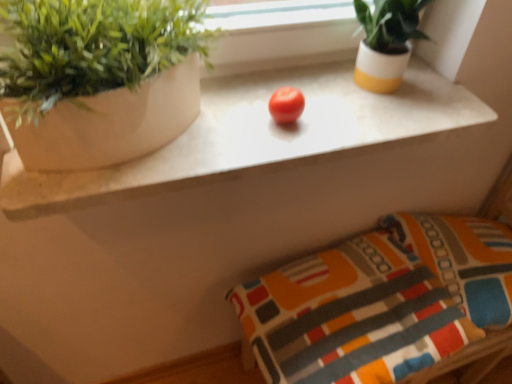
Question: Is textured fabric pillow at lower right, acting as the 2th pillow starting from the right, facing towards red matte tomato at center?

Choices:
 (A) no
 (B) yes

Answer: (A)

Question: Is textured fabric pillow at lower right, acting as the 2th pillow starting from the right, bigger than red matte tomato at center?

Choices:
 (A) yes
 (B) no

Answer: (A)

Question: Can you confirm if textured fabric pillow at lower right, the first pillow when ordered from left to right, is positioned to the left of red matte tomato at center?

Choices:
 (A) yes
 (B) no

Answer: (B)

Question: Is textured fabric pillow at lower right, the first pillow when ordered from left to right, far away from red matte tomato at center?

Choices:
 (A) no
 (B) yes

Answer: (A)

Question: From a real-world perspective, is textured fabric pillow at lower right, acting as the 2th pillow starting from the right, positioned under red matte tomato at center based on gravity?

Choices:
 (A) yes
 (B) no

Answer: (A)

Question: From the image's perspective, is textured fabric pillow at lower right, acting as the 2th pillow starting from the right, under red matte tomato at center?

Choices:
 (A) yes
 (B) no

Answer: (A)

Question: From the image's perspective, is white marble counter at center above red matte tomato at center?

Choices:
 (A) no
 (B) yes

Answer: (A)

Question: Is the position of white marble counter at center more distant than that of red matte tomato at center?

Choices:
 (A) no
 (B) yes

Answer: (A)

Question: Would you say white marble counter at center is outside red matte tomato at center?

Choices:
 (A) no
 (B) yes

Answer: (B)

Question: Is white marble counter at center touching red matte tomato at center?

Choices:
 (A) no
 (B) yes

Answer: (A)

Question: Is white marble counter at center shorter than red matte tomato at center?

Choices:
 (A) no
 (B) yes

Answer: (B)

Question: Is white marble counter at center smaller than red matte tomato at center?

Choices:
 (A) no
 (B) yes

Answer: (A)

Question: Is red matte tomato at center at the left side of textured fabric pillow at lower right, acting as the 2th pillow starting from the right?

Choices:
 (A) yes
 (B) no

Answer: (A)